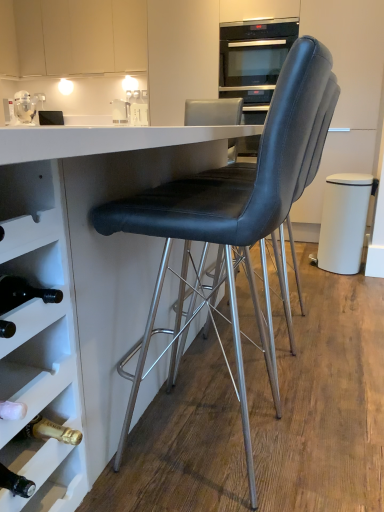
Question: Is black leather chair at center, the 2th chair in the front-to-back sequence, facing away from white matte trash can at right?

Choices:
 (A) no
 (B) yes

Answer: (A)

Question: Could you tell me if black leather chair at center, which is the first chair from back to front, is turned towards white matte trash can at right?

Choices:
 (A) yes
 (B) no

Answer: (B)

Question: Considering the relative sizes of black leather chair at center, the 2th chair in the front-to-back sequence, and white matte trash can at right in the image provided, is black leather chair at center, the 2th chair in the front-to-back sequence, smaller than white matte trash can at right?

Choices:
 (A) yes
 (B) no

Answer: (B)

Question: Considering the relative sizes of black leather chair at center, which is the first chair from back to front, and white matte trash can at right in the image provided, is black leather chair at center, which is the first chair from back to front, thinner than white matte trash can at right?

Choices:
 (A) no
 (B) yes

Answer: (A)

Question: Considering the relative sizes of black leather chair at center, which is the first chair from back to front, and white matte trash can at right in the image provided, is black leather chair at center, which is the first chair from back to front, shorter than white matte trash can at right?

Choices:
 (A) yes
 (B) no

Answer: (B)

Question: From the image's perspective, is white glossy table at center located above or below black leather chair at center, arranged as the 1th chair when viewed from the front?

Choices:
 (A) below
 (B) above

Answer: (B)

Question: Looking at their shapes, would you say white glossy table at center is wider or thinner than black leather chair at center, which is the second chair from back to front?

Choices:
 (A) wide
 (B) thin

Answer: (A)

Question: Is white glossy table at center bigger or smaller than black leather chair at center, which is the second chair from back to front?

Choices:
 (A) small
 (B) big

Answer: (B)

Question: From a real-world perspective, relative to black leather chair at center, which is the second chair from back to front, is white glossy table at center vertically above or below?

Choices:
 (A) below
 (B) above

Answer: (A)

Question: Is black leather chair at center, the 2th chair in the front-to-back sequence, inside the boundaries of white matte trash can at right, or outside?

Choices:
 (A) inside
 (B) outside

Answer: (B)

Question: Does point (322, 133) appear closer or farther from the camera than point (354, 176)?

Choices:
 (A) closer
 (B) farther

Answer: (A)

Question: Considering their positions, is black leather chair at center, which is the first chair from back to front, located in front of or behind white matte trash can at right?

Choices:
 (A) behind
 (B) front

Answer: (B)

Question: From the image's perspective, is black leather chair at center, the 2th chair in the front-to-back sequence, located above or below white matte trash can at right?

Choices:
 (A) above
 (B) below

Answer: (B)

Question: Based on their sizes in the image, would you say matte white cabinet at upper left is bigger or smaller than white matte trash can at right?

Choices:
 (A) small
 (B) big

Answer: (B)

Question: In the image, is matte white cabinet at upper left on the left side or the right side of white matte trash can at right?

Choices:
 (A) left
 (B) right

Answer: (A)